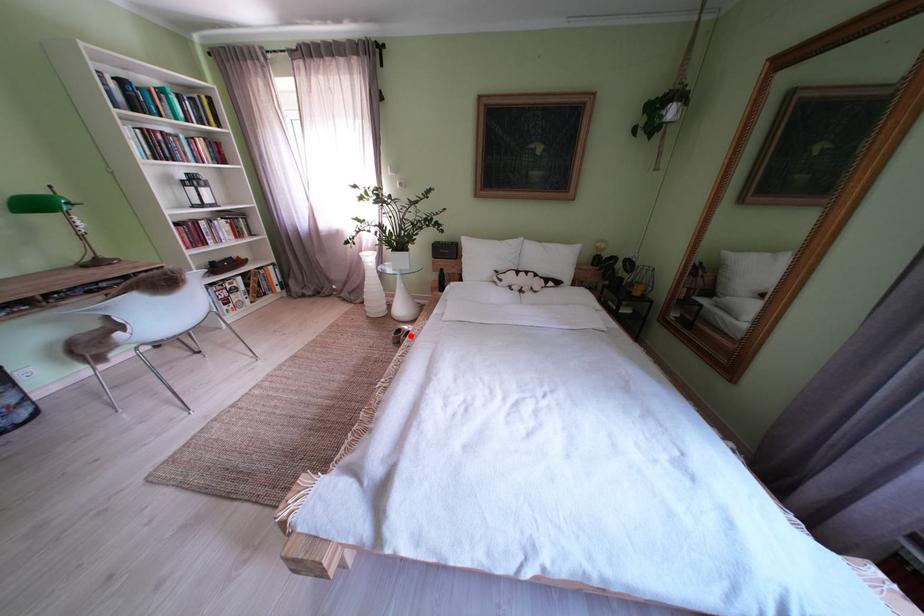
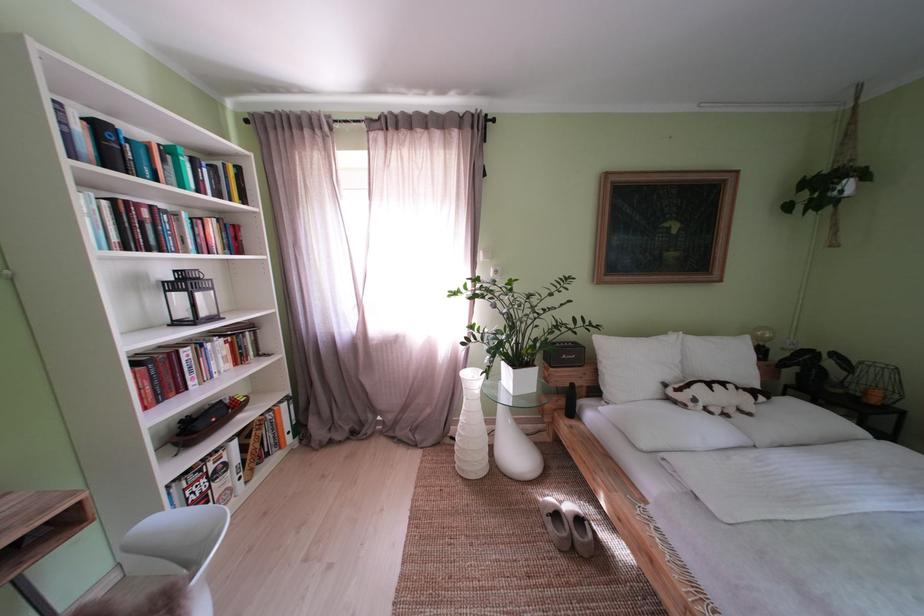
Question: I am providing you with two images of the same scene from different viewpoints. Image1 has a red point marked. In image2, the corresponding 3D location appears at what relative position? Reply with the corresponding letter.

Choices:
 (A) Closer
 (B) Farther

Answer: (A)